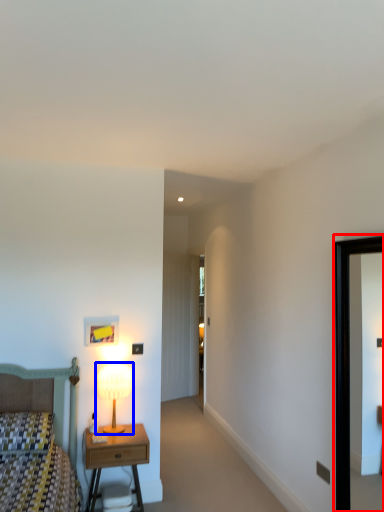
Question: Which object appears farthest to the camera in this image, picture frame (highlighted by a red box) or table lamp (highlighted by a blue box)?

Choices:
 (A) picture frame
 (B) table lamp

Answer: (B)